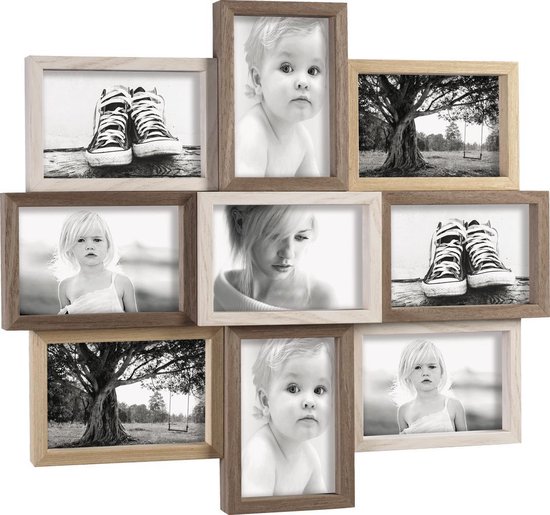
At what (x,y) coordinates should I click in order to perform the action: click on picture frames. Please return your answer as a coordinate pair (x, y). This screenshot has height=515, width=550. Looking at the image, I should click on (156, 453), (152, 323), (159, 185), (235, 185), (263, 320), (235, 397), (509, 385), (531, 316), (509, 187).